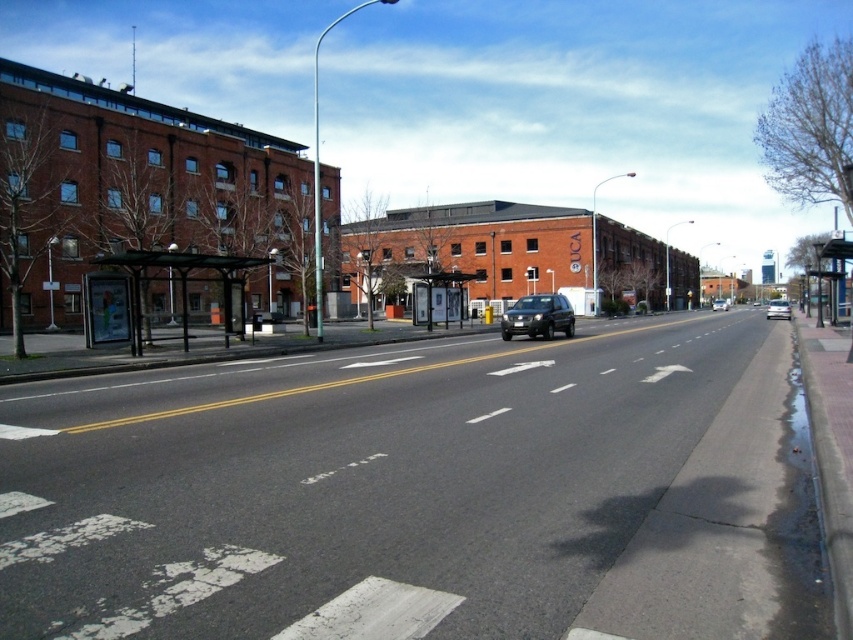
Which of these two, transparent plastic bus stop at lower left or white glossy sedan at right, stands shorter?

With less height is transparent plastic bus stop at lower left.

Does transparent plastic bus stop at lower left appear on the left side of white glossy sedan at right?

Correct, you'll find transparent plastic bus stop at lower left to the left of white glossy sedan at right.

Locate an element on the screen. This screenshot has width=853, height=640. transparent plastic bus stop at lower left is located at coordinates (186, 282).

Locate an element on the screen. transparent plastic bus stop at lower left is located at coordinates (186, 282).

Which is behind, point (241, 308) or point (558, 301)?

The point (558, 301) is more distant.

How distant is transparent plastic bus stop at lower left from satin black suv at center?

They are 13.27 meters apart.

Is point (138, 266) positioned in front of point (556, 300)?

Yes, point (138, 266) is in front of point (556, 300).

At what (x,y) coordinates should I click in order to perform the action: click on transparent plastic bus stop at lower left. Please return your answer as a coordinate pair (x, y). The width and height of the screenshot is (853, 640). Looking at the image, I should click on (186, 282).

Is transparent plastic bus stop at lower left taller than matte black suv at center?

Yes.

Who is shorter, transparent plastic bus stop at lower left or matte black suv at center?

matte black suv at center is shorter.

Which is behind, point (225, 300) or point (723, 305)?

The point (723, 305) is more distant.

Identify the location of transparent plastic bus stop at lower left. This screenshot has width=853, height=640. (186, 282).